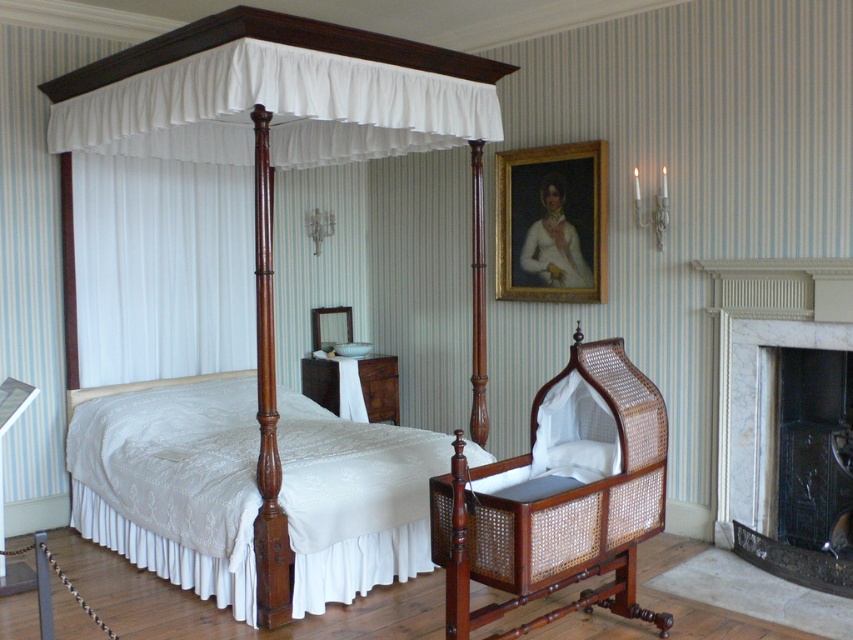
Which is in front, point (374, 512) or point (561, 392)?

Point (561, 392)

Can you confirm if matte wood bed frame at center is positioned below woven cane cradle at lower center?

Correct, matte wood bed frame at center is located below woven cane cradle at lower center.

The height and width of the screenshot is (640, 853). Describe the element at coordinates (173, 483) in the screenshot. I see `matte wood bed frame at center` at that location.

Identify the location of matte wood bed frame at center. (173, 483).

Can you confirm if mahogany wood canopy bed at center is positioned below goldwooden frame at upper center?

Incorrect, mahogany wood canopy bed at center is not positioned below goldwooden frame at upper center.

Identify the location of mahogany wood canopy bed at center. The width and height of the screenshot is (853, 640). (273, 42).

Can you confirm if matte wood bed frame at center is positioned to the left of white marble fireplace at right?

Correct, you'll find matte wood bed frame at center to the left of white marble fireplace at right.

Is matte wood bed frame at center positioned before white marble fireplace at right?

That is True.

Image resolution: width=853 pixels, height=640 pixels. I want to click on matte wood bed frame at center, so click(x=173, y=483).